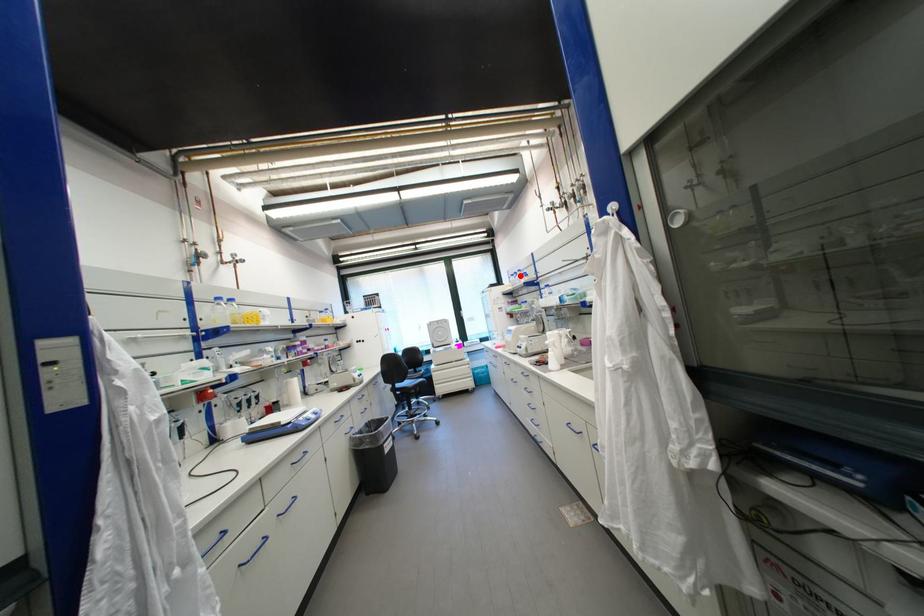
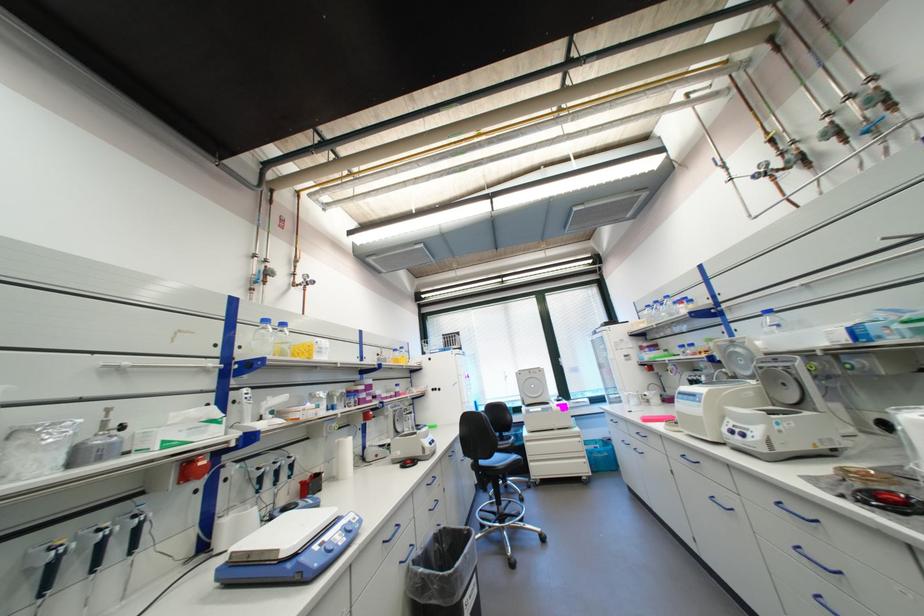
The point at the highlighted location is marked in the first image. Where is the corresponding point in the second image?

(655, 307)